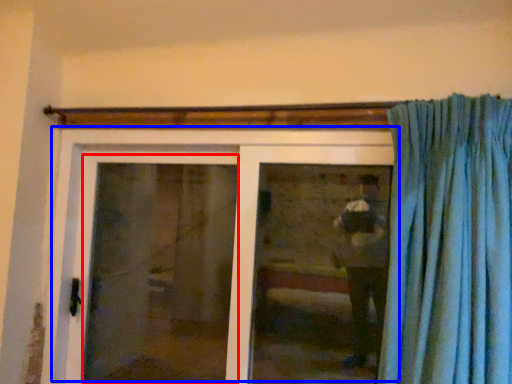
Question: Among these objects, which one is nearest to the camera, screen door (highlighted by a red box) or door (highlighted by a blue box)?

Choices:
 (A) screen door
 (B) door

Answer: (B)